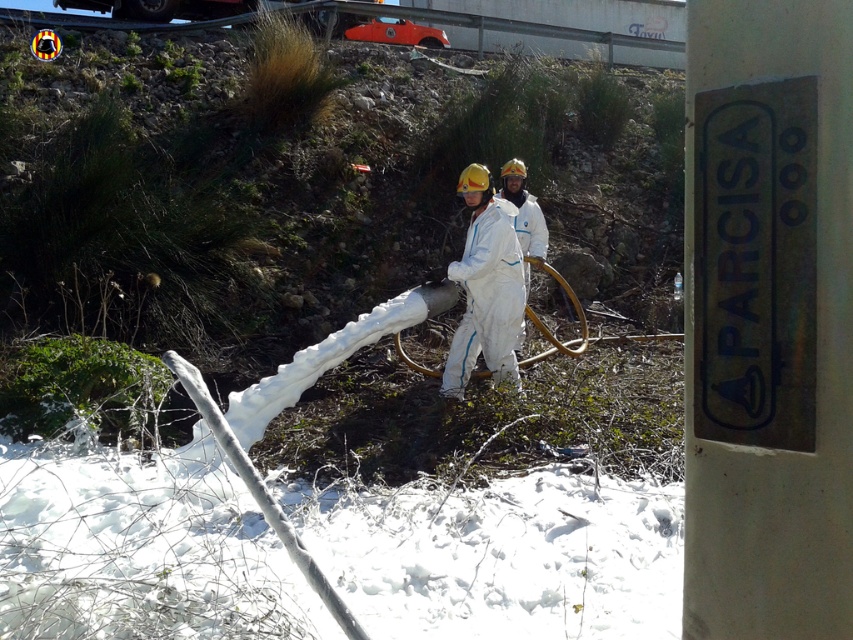
Question: Can you confirm if white metal sign at right is smaller than white matte suit at center?

Choices:
 (A) yes
 (B) no

Answer: (A)

Question: Is white metal sign at right above white matte suit at center?

Choices:
 (A) no
 (B) yes

Answer: (A)

Question: Which of the following is the closest to the observer?

Choices:
 (A) white matte suit at center
 (B) white metal sign at right

Answer: (B)

Question: Among these points, which one is nearest to the camera?

Choices:
 (A) (460, 340)
 (B) (729, 445)

Answer: (B)

Question: Can you confirm if white metal sign at right is positioned below white matte suit at center?

Choices:
 (A) no
 (B) yes

Answer: (B)

Question: Which point appears farthest from the camera in this image?

Choices:
 (A) (772, 38)
 (B) (498, 353)

Answer: (B)